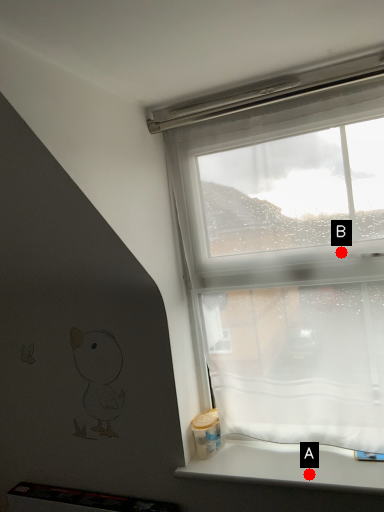
Question: Two points are circled on the image, labeled by A and B beside each circle. Which point is further to the camera?

Choices:
 (A) A is further
 (B) B is further

Answer: (B)